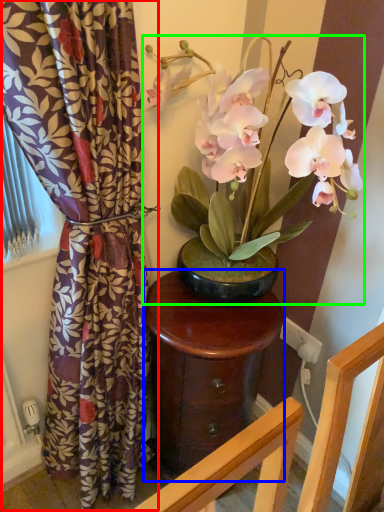
Question: Considering the real-world distances, which object is farthest from curtain (highlighted by a red box)? table (highlighted by a blue box) or houseplant (highlighted by a green box)?

Choices:
 (A) table
 (B) houseplant

Answer: (B)